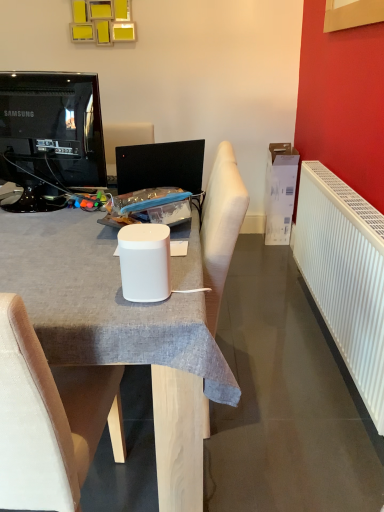
Locate an element on the screen. free area behind white matte speaker at center is located at coordinates (116, 262).